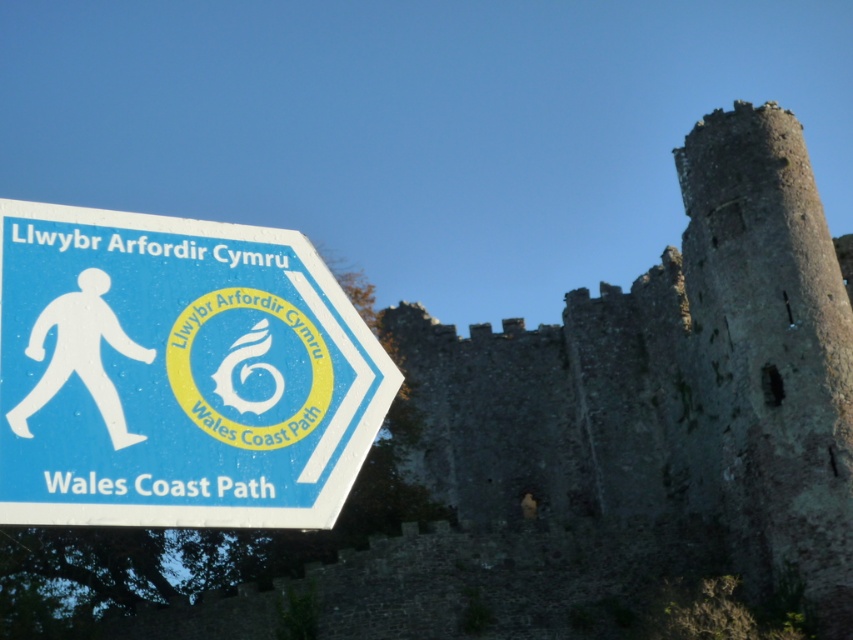
Question: Which object is closer to the camera taking this photo?

Choices:
 (A) blue plastic sign at left
 (B) gray stone castle at center

Answer: (A)

Question: From the image, what is the correct spatial relationship of gray stone castle at center in relation to blue plastic sign at left?

Choices:
 (A) above
 (B) below

Answer: (B)

Question: Does gray stone castle at center lie behind blue plastic sign at left?

Choices:
 (A) no
 (B) yes

Answer: (B)

Question: Does gray stone castle at center have a smaller size compared to blue plastic sign at left?

Choices:
 (A) no
 (B) yes

Answer: (A)